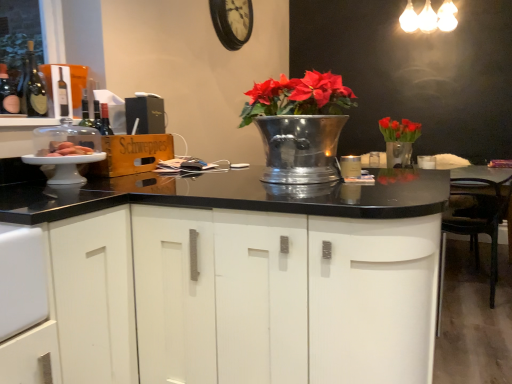
Question: From a real-world perspective, is black leather chair at right positioned above or below wooden clock at upper center?

Choices:
 (A) below
 (B) above

Answer: (A)

Question: Is point (481, 225) closer or farther from the camera than point (218, 6)?

Choices:
 (A) farther
 (B) closer

Answer: (B)

Question: Estimate the real-world distances between objects in this image. Which object is farther from the wooden clock at upper center?

Choices:
 (A) black leather chair at right
 (B) metallic silver vase at center
 (C) matte white cake at left
 (D) white matte cabinet at center
 (E) matte black wine bottle at left

Answer: (D)

Question: Estimate the real-world distances between objects in this image. Which object is farther from the matte white cake at left?

Choices:
 (A) white matte cabinet at center
 (B) matte black wine bottle at left
 (C) metallic silver vase at center
 (D) wooden clock at upper center
 (E) black leather chair at right

Answer: (E)